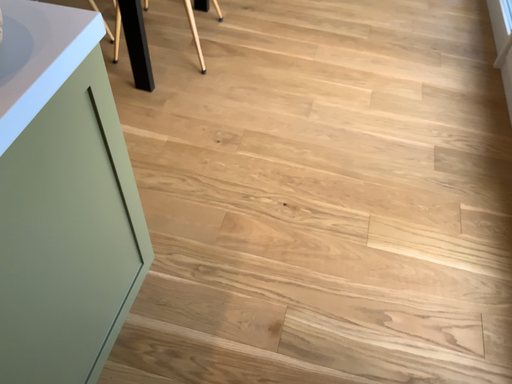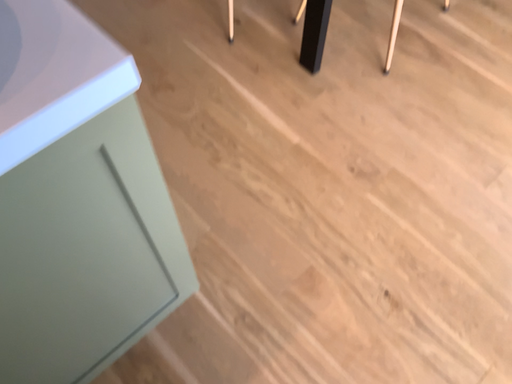
Question: Which way did the camera rotate in the video?

Choices:
 (A) rotated right
 (B) rotated left

Answer: (B)